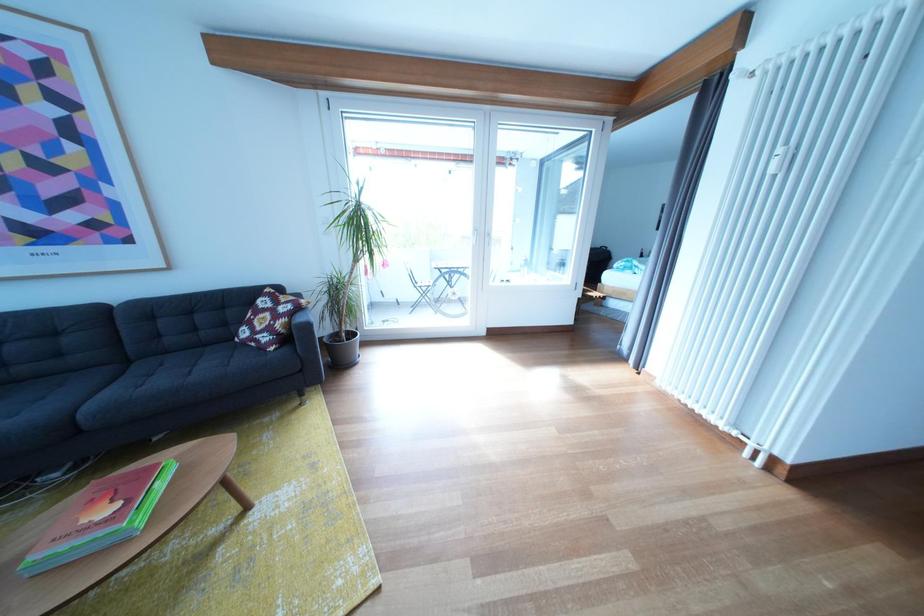
Locate an element on the screen. radiator thermostat is located at coordinates (785, 159).